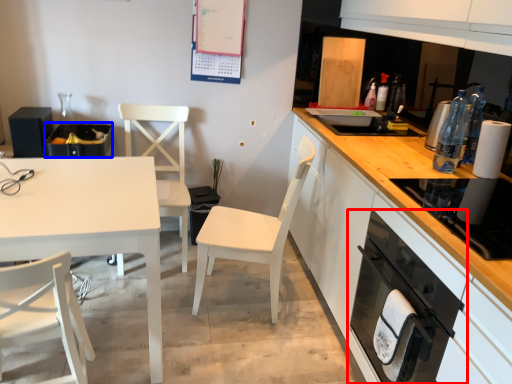
Question: Which point is closer to the camera, kitchen appliance (highlighted by a red box) or appliance (highlighted by a blue box)?

Choices:
 (A) kitchen appliance
 (B) appliance

Answer: (A)